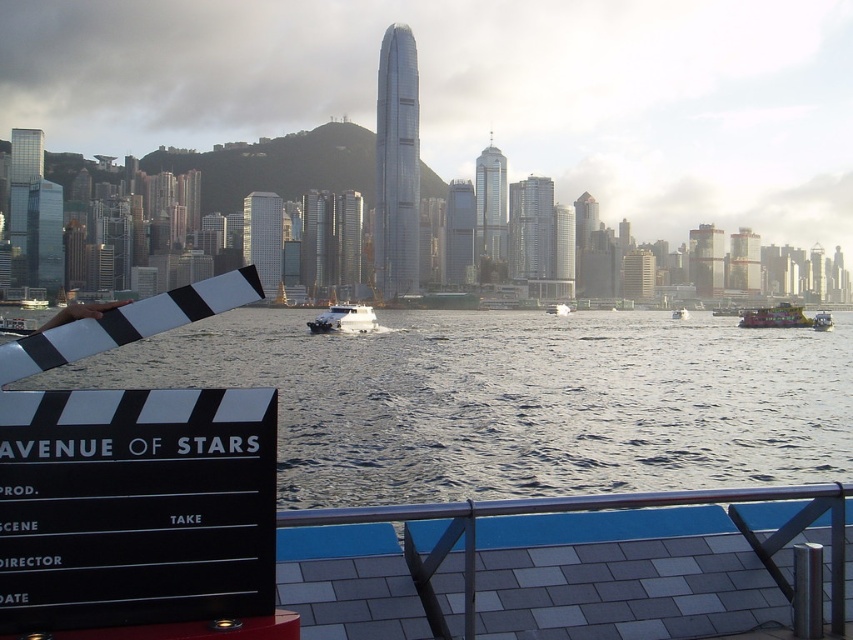
Question: Among these points, which one is farthest from the camera?

Choices:
 (A) (688, 312)
 (B) (350, 1)
 (C) (339, 493)
 (D) (828, 314)

Answer: (B)

Question: Which of the following is the closest to the observer?

Choices:
 (A) green plastic boat at center
 (B) clear water at center
 (C) black matte clapperboard at lower left
 (D) white glossy boat at center

Answer: (B)

Question: Does clear water at center come behind metallic green boat at center?

Choices:
 (A) no
 (B) yes

Answer: (A)

Question: Is black matte clapperboard at lower left positioned behind white plastic boat at center?

Choices:
 (A) yes
 (B) no

Answer: (A)

Question: From the image, what is the correct spatial relationship of black matte clapperboard at lower left in relation to white glossy boat at center?

Choices:
 (A) left
 (B) right

Answer: (B)

Question: Which point is closer to the camera?

Choices:
 (A) black matte clapperboard at lower left
 (B) metallic green boat at center
 (C) white plastic boat at center

Answer: (B)